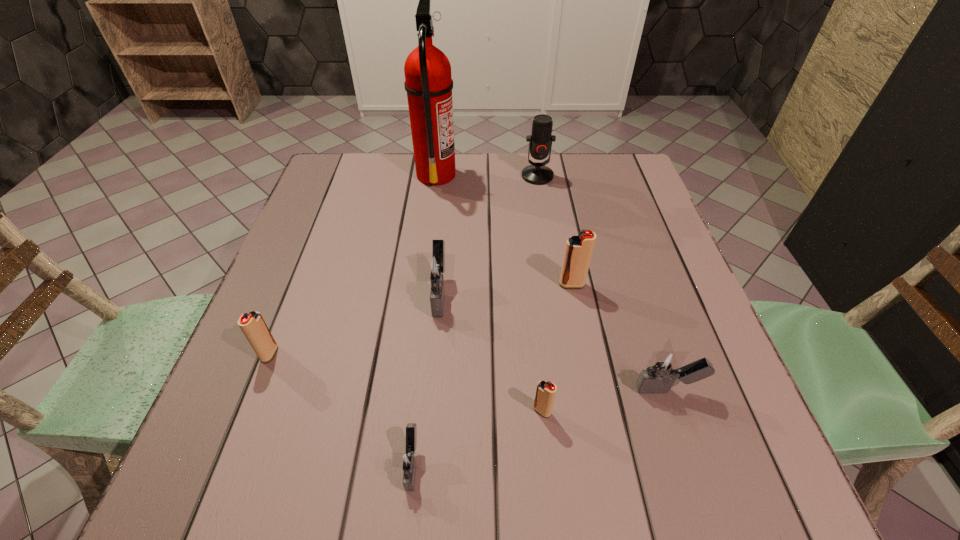
Where is `the fourth igniter from left to right`? The width and height of the screenshot is (960, 540). the fourth igniter from left to right is located at coordinates (545, 394).

This screenshot has height=540, width=960. I want to click on the nearest object, so click(409, 461).

At what (x,y) coordinates should I click in order to perform the action: click on the smallest gray igniter. Please return your answer as a coordinate pair (x, y). The width and height of the screenshot is (960, 540). Looking at the image, I should click on (409, 461).

This screenshot has width=960, height=540. Identify the location of free space located on the side of the fire extinguisher near the handle. (588, 174).

This screenshot has width=960, height=540. I want to click on free space located 0.170m on the side of the microphone with the red ring, so click(x=545, y=224).

This screenshot has width=960, height=540. Identify the location of free spot located 0.180m on the left of the farthest red igniter. (477, 285).

The height and width of the screenshot is (540, 960). I want to click on free space located 0.070m on the front of the farthest gray igniter, so click(x=436, y=347).

Find the location of a particular element. The width and height of the screenshot is (960, 540). vacant region located 0.370m on the left of the rightmost gray igniter is located at coordinates (430, 389).

The height and width of the screenshot is (540, 960). In order to click on free spot located on the front of the leftmost red igniter in this screenshot , I will do `click(252, 397)`.

Locate an element on the screen. The image size is (960, 540). vacant space located 0.240m on the left of the nearest red igniter is located at coordinates (396, 410).